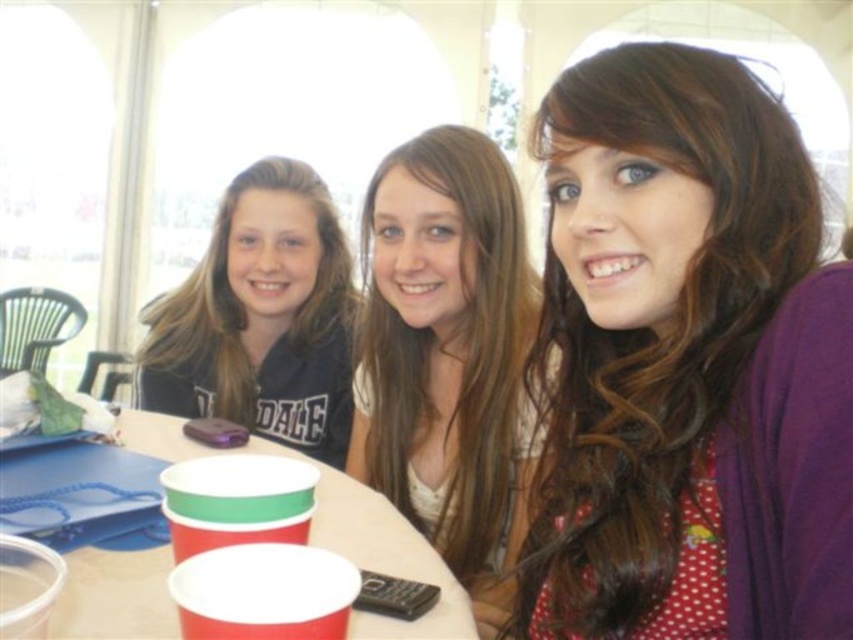
Question: Can you confirm if purple fabric at center is smaller than red paper cups at center?

Choices:
 (A) no
 (B) yes

Answer: (A)

Question: Estimate the real-world distances between objects in this image. Which object is closer to the red paper cup at lower center?

Choices:
 (A) red paper cups at center
 (B) purple fabric at center

Answer: (B)

Question: Does purple fabric at center appear on the right side of smooth white shirt at center?

Choices:
 (A) no
 (B) yes

Answer: (B)

Question: Which of these objects is positioned farthest from the red paper cup at center?

Choices:
 (A) matte black hoodie at upper left
 (B) smooth white shirt at center
 (C) purple fabric at center

Answer: (A)

Question: Which of the following is the closest to the observer?

Choices:
 (A) (618, 332)
 (B) (247, 538)
 (C) (386, 250)
 (D) (297, 259)

Answer: (B)

Question: Is purple fabric at center closer to the viewer compared to red paper cup at lower center?

Choices:
 (A) yes
 (B) no

Answer: (B)